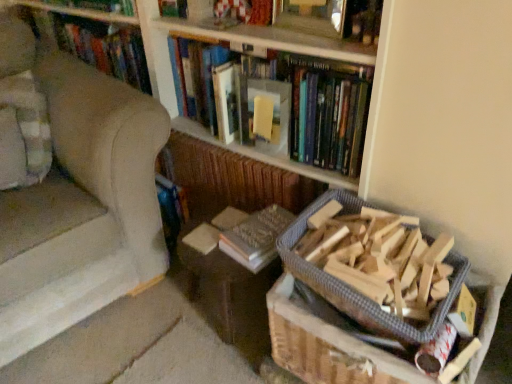
Question: Can beige fabric armchair at left be found inside brown cardboard box at lower right?

Choices:
 (A) no
 (B) yes

Answer: (A)

Question: From a real-world perspective, does brown cardboard box at lower right sit lower than beige fabric armchair at left?

Choices:
 (A) yes
 (B) no

Answer: (A)

Question: Does brown cardboard box at lower right come in front of beige fabric armchair at left?

Choices:
 (A) yes
 (B) no

Answer: (B)

Question: Is brown cardboard box at lower right outside beige fabric armchair at left?

Choices:
 (A) no
 (B) yes

Answer: (B)

Question: Is brown cardboard box at lower right shorter than beige fabric armchair at left?

Choices:
 (A) yes
 (B) no

Answer: (A)

Question: Is metallic silver picture frame at upper center spatially inside wooden bookcase at upper center, or outside of it?

Choices:
 (A) inside
 (B) outside

Answer: (A)

Question: From the image's perspective, relative to wooden bookcase at upper center, is metallic silver picture frame at upper center above or below?

Choices:
 (A) below
 (B) above

Answer: (B)

Question: Is point tap(294, 29) positioned closer to the camera than point tap(335, 49)?

Choices:
 (A) closer
 (B) farther

Answer: (B)

Question: In terms of height, does metallic silver picture frame at upper center look taller or shorter compared to wooden bookcase at upper center?

Choices:
 (A) tall
 (B) short

Answer: (B)

Question: Based on their positions, is brown cardboard box at lower right located to the left or right of wooden frame at upper center, acting as the 3th book starting from the bottom?

Choices:
 (A) right
 (B) left

Answer: (A)

Question: In the image, is brown cardboard box at lower right positioned in front of or behind wooden frame at upper center, acting as the 3th book starting from the bottom?

Choices:
 (A) front
 (B) behind

Answer: (A)

Question: From the image's perspective, relative to wooden frame at upper center, which is the 1th book in top-to-bottom order, is brown cardboard box at lower right above or below?

Choices:
 (A) above
 (B) below

Answer: (B)

Question: Considering the positions of brown cardboard box at lower right and wooden frame at upper center, which is the 1th book in top-to-bottom order, in the image, is brown cardboard box at lower right bigger or smaller than wooden frame at upper center, which is the 1th book in top-to-bottom order,?

Choices:
 (A) big
 (B) small

Answer: (A)

Question: Considering the positions of yellow paper at upper center and wooden frame at upper center, acting as the 3th book starting from the bottom, in the image, is yellow paper at upper center wider or thinner than wooden frame at upper center, acting as the 3th book starting from the bottom,?

Choices:
 (A) wide
 (B) thin

Answer: (B)

Question: Is yellow paper at upper center taller or shorter than wooden frame at upper center, which is the 1th book in top-to-bottom order?

Choices:
 (A) tall
 (B) short

Answer: (A)